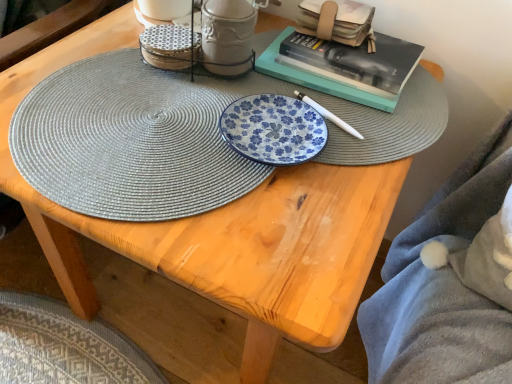
Locate an element on the screen. free space in front of hardcover book at upper right is located at coordinates (337, 117).